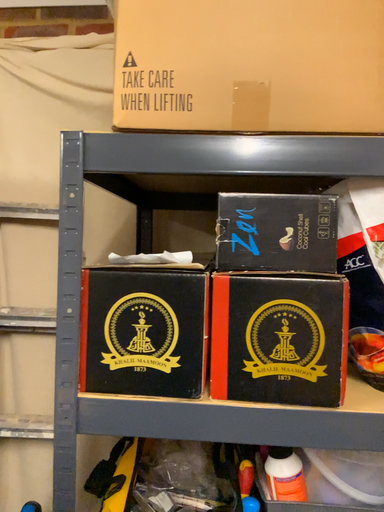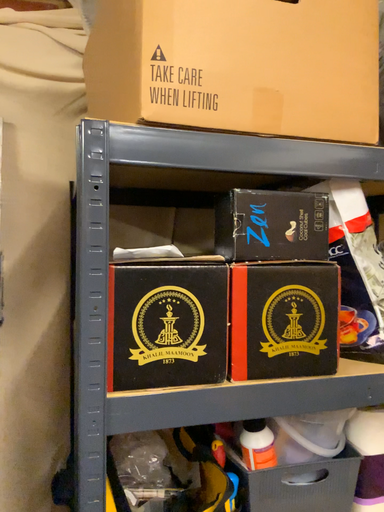
Question: How did the camera likely rotate when shooting the video?

Choices:
 (A) rotated right
 (B) rotated left

Answer: (A)